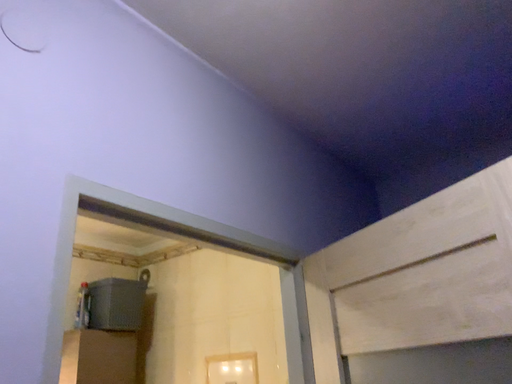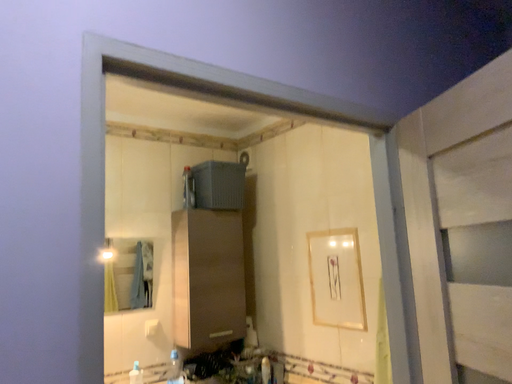
Question: How did the camera likely rotate when shooting the video?

Choices:
 (A) rotated right
 (B) rotated left

Answer: (B)